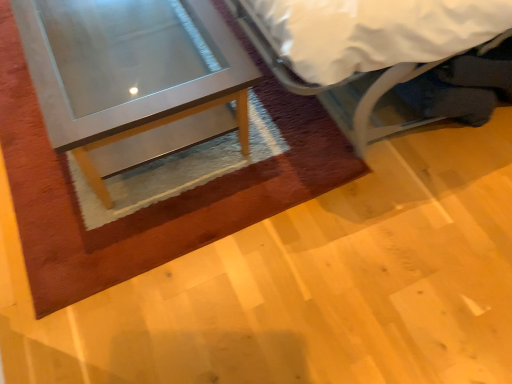
Question: Based on their sizes in the image, would you say white fabric bed at upper right is bigger or smaller than matte glass table at left?

Choices:
 (A) small
 (B) big

Answer: (B)

Question: Is white fabric bed at upper right situated inside matte glass table at left or outside?

Choices:
 (A) inside
 (B) outside

Answer: (B)

Question: From a real-world perspective, relative to matte glass table at left, is white fabric bed at upper right vertically above or below?

Choices:
 (A) above
 (B) below

Answer: (A)

Question: Choose the correct answer: Is matte glass table at left inside white fabric bed at upper right or outside it?

Choices:
 (A) inside
 (B) outside

Answer: (B)

Question: From the image's perspective, is matte glass table at left above or below white fabric bed at upper right?

Choices:
 (A) above
 (B) below

Answer: (B)

Question: In the image, is matte glass table at left on the left side or the right side of white fabric bed at upper right?

Choices:
 (A) left
 (B) right

Answer: (A)

Question: Is matte glass table at left wider or thinner than white fabric bed at upper right?

Choices:
 (A) wide
 (B) thin

Answer: (B)